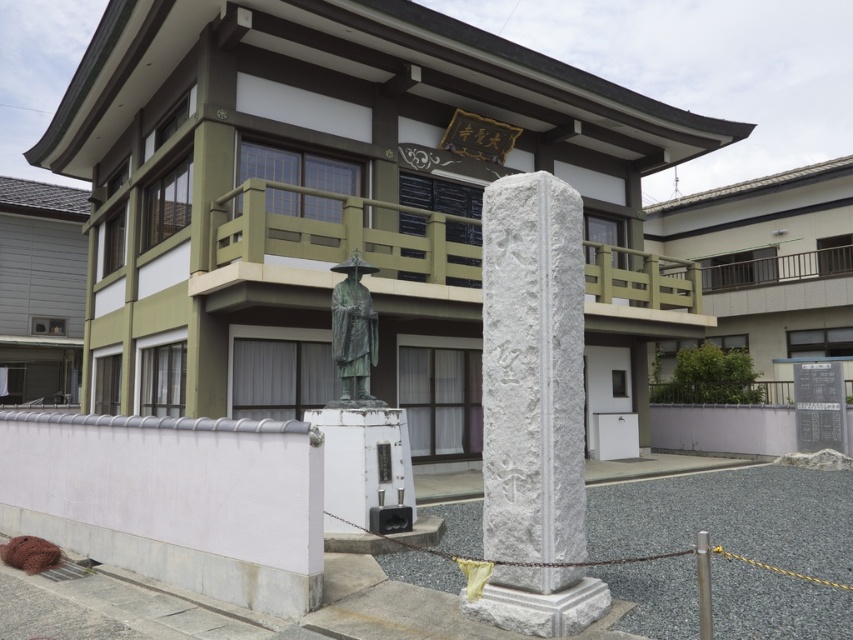
Question: In this image, where is white stone pillar at center located relative to bronze statue at center?

Choices:
 (A) left
 (B) right

Answer: (B)

Question: Which point is closer to the camera?

Choices:
 (A) (469, 609)
 (B) (341, 392)

Answer: (A)

Question: Which point appears farthest from the camera in this image?

Choices:
 (A) (340, 307)
 (B) (503, 445)

Answer: (A)

Question: Among these objects, which one is farthest from the camera?

Choices:
 (A) bronze statue at center
 (B) white stone pillar at center

Answer: (A)

Question: Is white stone pillar at center wider than bronze statue at center?

Choices:
 (A) yes
 (B) no

Answer: (A)

Question: Is white stone pillar at center further to camera compared to bronze statue at center?

Choices:
 (A) no
 (B) yes

Answer: (A)